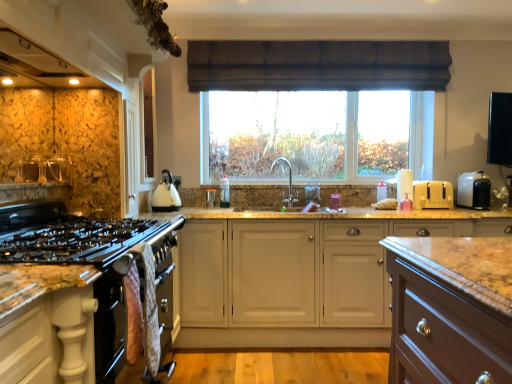
The height and width of the screenshot is (384, 512). Find the location of `brown fabric curtain at upper center`. brown fabric curtain at upper center is located at coordinates pos(318,65).

You are a GUI agent. You are given a task and a screenshot of the screen. Output one action in this format:
    pyautogui.click(x=<x>, y=<y>)
    Task: Click on the white plastic toaster at right, marked as the first appliance in a right-to-left arrangement
    The height and width of the screenshot is (384, 512).
    Given the screenshot: What is the action you would take?
    pyautogui.click(x=474, y=190)

The height and width of the screenshot is (384, 512). Describe the element at coordinates (36, 61) in the screenshot. I see `matte white exhaust hood at upper left` at that location.

Describe the element at coordinates (110, 326) in the screenshot. I see `quilted fabric oven mitts at lower left` at that location.

The height and width of the screenshot is (384, 512). In order to click on white glossy kettle at center in this screenshot , I will do `click(166, 194)`.

Is quilted fabric oven mitts at lower left closer to the viewer compared to white glossy kettle at center?

Yes, the depth of quilted fabric oven mitts at lower left is less than that of white glossy kettle at center.

Would you say quilted fabric oven mitts at lower left is outside white glossy kettle at center?

quilted fabric oven mitts at lower left lies outside white glossy kettle at center's area.

Looking at this image, who is taller, quilted fabric oven mitts at lower left or white glossy kettle at center?

Standing taller between the two is quilted fabric oven mitts at lower left.

From the image's perspective, is white matte cabinet at center, arranged as the 2th cabinetry when viewed from the left, located beneath white glossy kettle at center?

Yes, from the image's perspective, white matte cabinet at center, arranged as the 2th cabinetry when viewed from the left, is below white glossy kettle at center.

Is point (227, 301) positioned before point (158, 202)?

Yes.

Which of these two, white matte cabinet at center, which is the 1th cabinetry from back to front, or white glossy kettle at center, is bigger?

Bigger between the two is white matte cabinet at center, which is the 1th cabinetry from back to front.

Can you tell me how much white matte cabinet at center, positioned as the 1th cabinetry in right-to-left order, and white glossy kettle at center differ in facing direction?

white matte cabinet at center, positioned as the 1th cabinetry in right-to-left order, and white glossy kettle at center are facing 91 degrees away from each other.

Which is in front, white glossy kettle at center or brown fabric curtain at upper center?

white glossy kettle at center is in front.

Does white glossy kettle at center have a smaller size compared to brown fabric curtain at upper center?

Indeed, white glossy kettle at center has a smaller size compared to brown fabric curtain at upper center.

Is white glossy kettle at center to the right of brown fabric curtain at upper center from the viewer's perspective?

In fact, white glossy kettle at center is to the left of brown fabric curtain at upper center.

Can you confirm if black glass gas stove at left is shorter than matte white exhaust hood at upper left?

Incorrect, the height of black glass gas stove at left does not fall short of that of matte white exhaust hood at upper left.

From the image's perspective, is black glass gas stove at left located above matte white exhaust hood at upper left?

No, from the image's perspective, black glass gas stove at left is not above matte white exhaust hood at upper left.

Locate an element on the screen. The height and width of the screenshot is (384, 512). exhaust hood located behind the black glass gas stove at left is located at coordinates (36, 61).

Is white matte cabinet at center, positioned as the 1th cabinetry in right-to-left order, to the left of white plastic toaster at right, marked as the first appliance in a right-to-left arrangement, from the viewer's perspective?

Yes, white matte cabinet at center, positioned as the 1th cabinetry in right-to-left order, is to the left of white plastic toaster at right, marked as the first appliance in a right-to-left arrangement.

Considering the points (370, 233) and (475, 174), which point is behind, point (370, 233) or point (475, 174)?

The point (475, 174) is more distant.

Is the depth of white matte cabinet at center, marked as the second cabinetry in a front-to-back arrangement, less than that of white plastic toaster at right, marked as the first appliance in a right-to-left arrangement?

Result: Yes, it is in front of white plastic toaster at right, marked as the first appliance in a right-to-left arrangement.

Image resolution: width=512 pixels, height=384 pixels. What are the coordinates of `the 1st cabinetry in front when counting from the white plastic toaster at right, the 2th appliance from the left` in the screenshot? It's located at (297, 275).

Are black glass gas stove at left and white matte cabinet at center, arranged as the 2th cabinetry when viewed from the left, far apart?

Yes, black glass gas stove at left and white matte cabinet at center, arranged as the 2th cabinetry when viewed from the left, are located far from each other.

From a real-world perspective, between black glass gas stove at left and white matte cabinet at center, marked as the second cabinetry in a front-to-back arrangement, who is vertically lower?

From a 3D spatial view, white matte cabinet at center, marked as the second cabinetry in a front-to-back arrangement, is below.

Is black glass gas stove at left facing towards white matte cabinet at center, marked as the second cabinetry in a front-to-back arrangement?

No, black glass gas stove at left does not turn towards white matte cabinet at center, marked as the second cabinetry in a front-to-back arrangement.

Considering the relative sizes of black glass gas stove at left and white matte cabinet at center, arranged as the 2th cabinetry when viewed from the left, in the image provided, is black glass gas stove at left bigger than white matte cabinet at center, arranged as the 2th cabinetry when viewed from the left,?

No.

This screenshot has width=512, height=384. Identify the location of the 2nd appliance positioned below the brown fabric curtain at upper center (from a real-world perspective). (432, 195).

Could you tell me if yellow plastic toaster at right, marked as the 2th appliance in a right-to-left arrangement, is turned towards brown fabric curtain at upper center?

No.

How many degrees apart are the facing directions of yellow plastic toaster at right, marked as the 2th appliance in a right-to-left arrangement, and brown fabric curtain at upper center?

There is a 1.58-degree angle between the facing directions of yellow plastic toaster at right, marked as the 2th appliance in a right-to-left arrangement, and brown fabric curtain at upper center.

Find the location of a particular element. oven in front of the white glossy kettle at center is located at coordinates (110, 326).

From the image's perspective, which cabinetry is the 1st one below the white glossy kettle at center? Please provide its 2D coordinates.

[(297, 275)]

From the image, which object appears to be farther from granite countertop at lower left, white plastic toaster at right, marked as the first appliance in a right-to-left arrangement, or brown fabric curtain at upper center?

white plastic toaster at right, marked as the first appliance in a right-to-left arrangement, is positioned further to the anchor granite countertop at lower left.

Which object lies further to the anchor point white matte cabinet at center, which is the 1th cabinetry from back to front, quilted fabric oven mitts at lower left or white plastic toaster at right, the 2th appliance from the left?

quilted fabric oven mitts at lower left is positioned further to the anchor white matte cabinet at center, which is the 1th cabinetry from back to front.

Looking at the image, which one is located further to brown fabric curtain at upper center, satin nickel faucet at center or black glass gas stove at left?

black glass gas stove at left.

Estimate the real-world distances between objects in this image. Which object is further from brown fabric curtain at upper center, satin nickel faucet at center or white plastic toaster at right, the 2th appliance from the left?

Based on the image, white plastic toaster at right, the 2th appliance from the left, appears to be further to brown fabric curtain at upper center.

Looking at this image, which object lies nearer to the anchor point black matte oven mitts at lower left, which is counted as the first cabinetry, starting from the left, brown fabric curtain at upper center or white matte cabinet at center, marked as the second cabinetry in a front-to-back arrangement?

Among the two, white matte cabinet at center, marked as the second cabinetry in a front-to-back arrangement, is located nearer to black matte oven mitts at lower left, which is counted as the first cabinetry, starting from the left.

Looking at the image, which one is located further to white matte cabinet at center, marked as the second cabinetry in a front-to-back arrangement, white glossy kettle at center or brown fabric curtain at upper center?

Based on the image, brown fabric curtain at upper center appears to be further to white matte cabinet at center, marked as the second cabinetry in a front-to-back arrangement.

Which object lies further to the anchor point white matte cabinet at center, marked as the second cabinetry in a front-to-back arrangement, white glossy kettle at center or black glass gas stove at left?

Among the two, black glass gas stove at left is located further to white matte cabinet at center, marked as the second cabinetry in a front-to-back arrangement.

Looking at the image, which one is located further to brown fabric curtain at upper center, yellow plastic toaster at right, the 1th appliance when ordered from left to right, or white matte cabinet at center, positioned as the 1th cabinetry in right-to-left order?

white matte cabinet at center, positioned as the 1th cabinetry in right-to-left order, is positioned further to the anchor brown fabric curtain at upper center.

At what (x,y) coordinates should I click in order to perform the action: click on appliance between brown fabric curtain at upper center and white plastic toaster at right, the 2th appliance from the left, from left to right. Please return your answer as a coordinate pair (x, y). The height and width of the screenshot is (384, 512). Looking at the image, I should click on (432, 195).

Find the location of a particular element. This screenshot has height=384, width=512. oven between black matte oven mitts at lower left, the 2th cabinetry viewed from the back, and brown fabric curtain at upper center in the front-back direction is located at coordinates (110, 326).

At what (x,y) coordinates should I click in order to perform the action: click on gas stove between matte white exhaust hood at upper left and quilted fabric oven mitts at lower left in the vertical direction. Please return your answer as a coordinate pair (x, y). This screenshot has width=512, height=384. Looking at the image, I should click on (79, 241).

Locate an element on the screen. The width and height of the screenshot is (512, 384). oven between black matte oven mitts at lower left, which is counted as the first cabinetry, starting from the left, and yellow plastic toaster at right, the 1th appliance when ordered from left to right, from left to right is located at coordinates (110, 326).